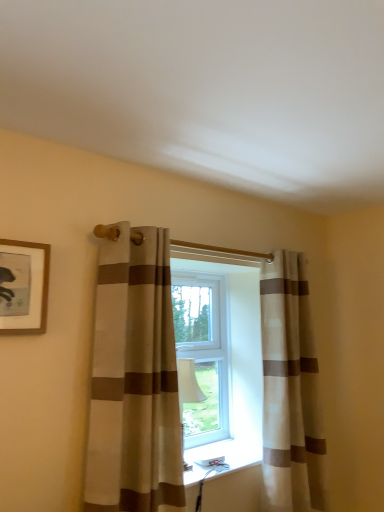
Question: From the image's perspective, is beige striped curtain at center, the 2th curtain when ordered from left to right, on top of beige striped curtain at center, placed as the 1th curtain when sorted from front to back?

Choices:
 (A) yes
 (B) no

Answer: (B)

Question: From the image's perspective, would you say beige striped curtain at center, arranged as the first curtain when viewed from the back, is shown under beige striped curtain at center, which is the 2th curtain from right to left?

Choices:
 (A) no
 (B) yes

Answer: (B)

Question: Does beige striped curtain at center, which is the 1th curtain in right-to-left order, contain beige striped curtain at center, which is the 2th curtain from right to left?

Choices:
 (A) no
 (B) yes

Answer: (A)

Question: Does beige striped curtain at center, the 2th curtain when ordered from left to right, have a smaller size compared to beige striped curtain at center, which is the 2th curtain from right to left?

Choices:
 (A) yes
 (B) no

Answer: (A)

Question: Is beige striped curtain at center, which is the 2th curtain from right to left, wider or thinner than beige striped curtain at center, the 2th curtain when ordered from left to right?

Choices:
 (A) thin
 (B) wide

Answer: (B)

Question: Visually, is beige striped curtain at center, placed as the 1th curtain when sorted from front to back, positioned to the left or to the right of beige striped curtain at center, arranged as the first curtain when viewed from the back?

Choices:
 (A) right
 (B) left

Answer: (B)

Question: Is beige striped curtain at center, the 2th curtain when ordered from back to front, in front of or behind beige striped curtain at center, arranged as the first curtain when viewed from the back, in the image?

Choices:
 (A) behind
 (B) front

Answer: (B)

Question: Is beige striped curtain at center, the 2th curtain when ordered from back to front, situated inside beige striped curtain at center, which is the 1th curtain in right-to-left order, or outside?

Choices:
 (A) inside
 (B) outside

Answer: (B)

Question: Is beige striped curtain at center, the 2th curtain when ordered from back to front, bigger or smaller than wooden-framed picture at upper left?

Choices:
 (A) big
 (B) small

Answer: (A)

Question: From the image's perspective, relative to wooden-framed picture at upper left, is beige striped curtain at center, the 2th curtain when ordered from back to front, above or below?

Choices:
 (A) above
 (B) below

Answer: (B)

Question: Considering the positions of beige striped curtain at center, the 2th curtain when ordered from back to front, and wooden-framed picture at upper left in the image, is beige striped curtain at center, the 2th curtain when ordered from back to front, taller or shorter than wooden-framed picture at upper left?

Choices:
 (A) tall
 (B) short

Answer: (A)

Question: Choose the correct answer: Is beige striped curtain at center, acting as the first curtain starting from the left, inside wooden-framed picture at upper left or outside it?

Choices:
 (A) outside
 (B) inside

Answer: (A)

Question: In terms of size, does wooden-framed picture at upper left appear bigger or smaller than beige striped curtain at center, the 2th curtain when ordered from back to front?

Choices:
 (A) small
 (B) big

Answer: (A)

Question: From a real-world perspective, is wooden-framed picture at upper left above or below beige striped curtain at center, which is the 2th curtain from right to left?

Choices:
 (A) below
 (B) above

Answer: (B)